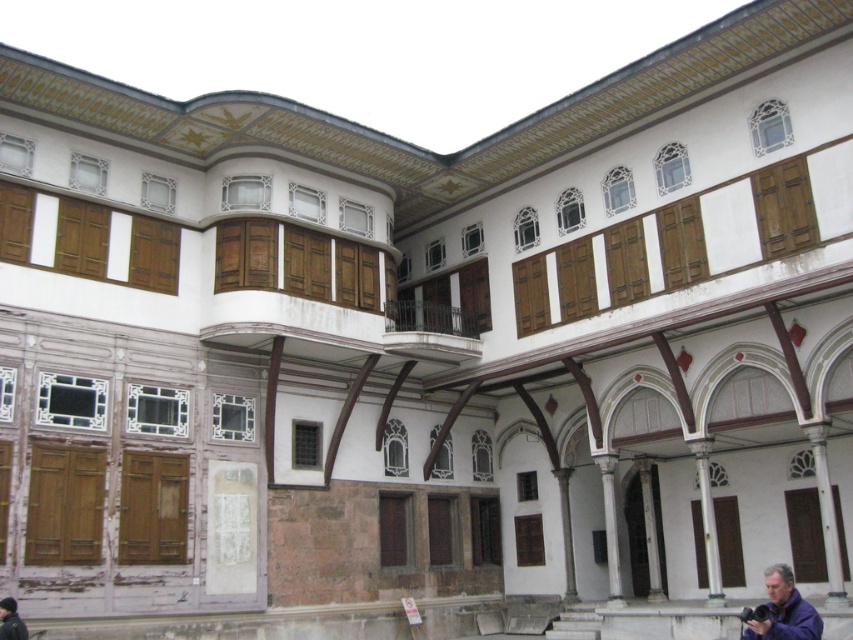
Question: Among these objects, which one is farthest from the camera?

Choices:
 (A) purple fabric at lower right
 (B) dark blue fabric at lower left

Answer: (B)

Question: Is purple fabric at lower right wider than dark blue fabric at lower left?

Choices:
 (A) yes
 (B) no

Answer: (A)

Question: Which object appears farthest from the camera in this image?

Choices:
 (A) dark blue fabric at lower left
 (B) purple fabric at lower right

Answer: (A)

Question: Among these objects, which one is nearest to the camera?

Choices:
 (A) purple fabric at lower right
 (B) dark blue fabric at lower left

Answer: (A)

Question: Is purple fabric at lower right above dark blue fabric at lower left?

Choices:
 (A) yes
 (B) no

Answer: (B)

Question: In this image, where is purple fabric at lower right located relative to dark blue fabric at lower left?

Choices:
 (A) right
 (B) left

Answer: (A)